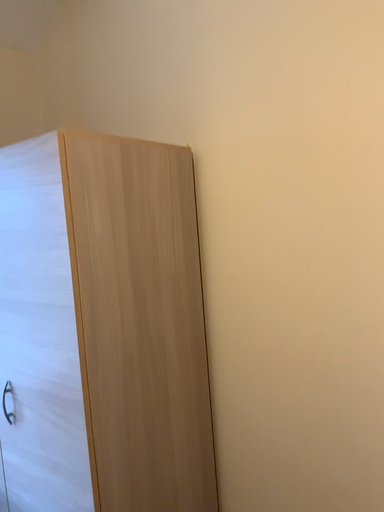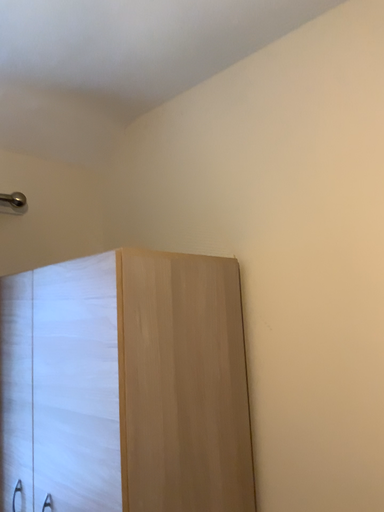
Question: Which way did the camera rotate in the video?

Choices:
 (A) rotated upward
 (B) rotated downward

Answer: (A)